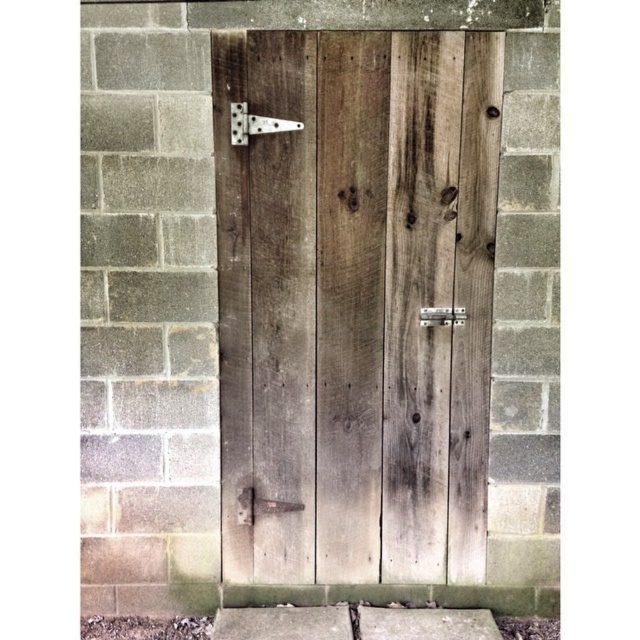
You are trying to open the door but the metallic silver lock at center is blocking the matte metal hinge at upper left. Can you move the lock to access the hinge?

The matte metal hinge at upper left is in front of the metallic silver lock at center, so the lock is behind the hinge and does not block access to it. You can reach the hinge without moving the lock.

You are a delivery person trying to deliver a package. You see the weathered wood door at center and the metallic silver lock at center. How far apart are these two items?

The distance between the weathered wood door at center and the metallic silver lock at center is 13.07 inches.